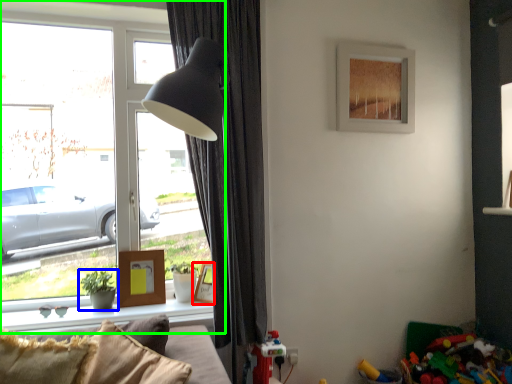
Question: Based on their relative distances, which object is nearer to picture frame (highlighted by a red box)? Choose from houseplant (highlighted by a blue box) and window (highlighted by a green box).

Choices:
 (A) houseplant
 (B) window

Answer: (A)